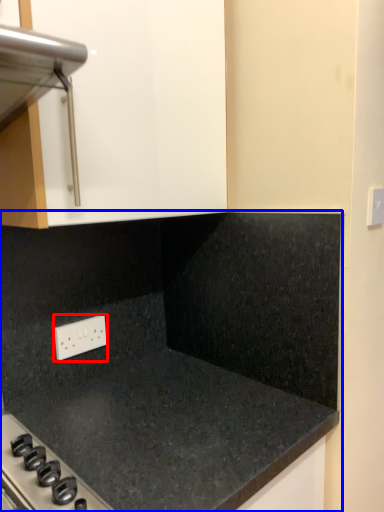
Question: Which object appears farthest to the camera in this image, electric outlet (highlighted by a red box) or countertop (highlighted by a blue box)?

Choices:
 (A) electric outlet
 (B) countertop

Answer: (A)